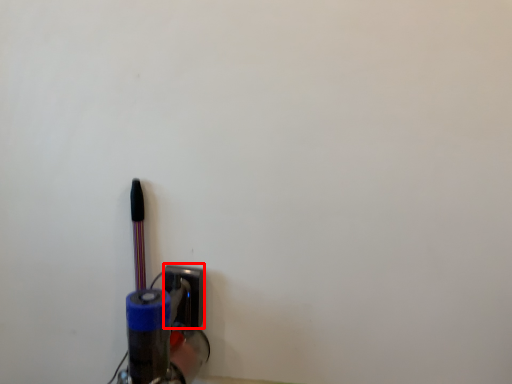
Question: From the image's perspective, what is the correct spatial positioning of socket (annotated by the red box) in reference to penguin?

Choices:
 (A) below
 (B) above

Answer: (A)